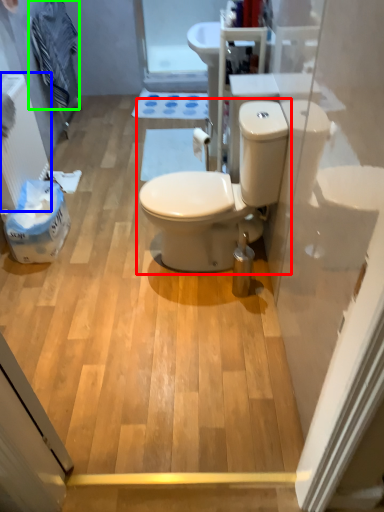
Question: Which object is the farthest from toilet (highlighted by a red box)? Choose among these: radiator (highlighted by a blue box) or laundry (highlighted by a green box).

Choices:
 (A) radiator
 (B) laundry

Answer: (B)